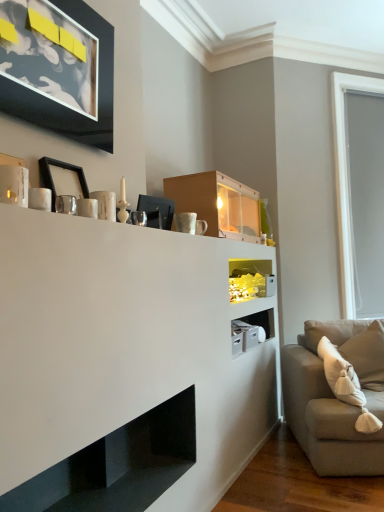
What do you see at coordinates (218, 204) in the screenshot? Image resolution: width=384 pixels, height=512 pixels. I see `matte wood cabinet at upper center` at bounding box center [218, 204].

This screenshot has height=512, width=384. Describe the element at coordinates (346, 177) in the screenshot. I see `gray matte window screen at right` at that location.

What is the approximate width of black glossy shelf at lower center, arranged as the second shelf when viewed from the back?

black glossy shelf at lower center, arranged as the second shelf when viewed from the back, is 16.80 inches in width.

Identify the location of black matte picture frame at upper left, the second picture frame from the bottom. This screenshot has height=512, width=384. (58, 68).

Describe the element at coordinates (52, 179) in the screenshot. I see `black matte picture frame at upper left, the second picture frame positioned from the top` at that location.

Locate an element on the screen. The height and width of the screenshot is (512, 384). light gray fabric couch at right is located at coordinates (337, 396).

Find the location of a particular element. matte wood cabinet at upper center is located at coordinates (218, 204).

Can you tell me how much beige soft cushion at right and matte wood cabinet at upper center differ in facing direction?

66.6 degrees.

Which object is positioned more to the left, beige soft cushion at right or matte wood cabinet at upper center?

From the viewer's perspective, matte wood cabinet at upper center appears more on the left side.

From the picture: Does beige soft cushion at right have a greater height compared to matte wood cabinet at upper center?

Yes, beige soft cushion at right is taller than matte wood cabinet at upper center.

Is beige soft cushion at right wider than matte wood cabinet at upper center?

Incorrect, the width of beige soft cushion at right does not surpass that of matte wood cabinet at upper center.

What's the angular difference between beige soft cushion at right and light gray fabric couch at right's facing directions?

0.484 degrees separate the facing orientations of beige soft cushion at right and light gray fabric couch at right.

Is beige soft cushion at right positioned far away from light gray fabric couch at right?

That's not correct — beige soft cushion at right is a little close to light gray fabric couch at right.

Which object is positioned more to the right, beige soft cushion at right or light gray fabric couch at right?

From the viewer's perspective, beige soft cushion at right appears more on the right side.

From the image's perspective, would you say beige soft cushion at right is positioned over light gray fabric couch at right?

Indeed, from the image's perspective, beige soft cushion at right is shown above light gray fabric couch at right.

How different are the orientations of black matte picture frame at upper left, which is counted as the 1th picture frame, starting from the top, and light gray fabric couch at right in degrees?

There is a 66.9-degree angle between the facing directions of black matte picture frame at upper left, which is counted as the 1th picture frame, starting from the top, and light gray fabric couch at right.

Could you tell me if black matte picture frame at upper left, the second picture frame from the bottom, is turned towards light gray fabric couch at right?

No, black matte picture frame at upper left, the second picture frame from the bottom, is not facing towards light gray fabric couch at right.

Is black matte picture frame at upper left, the second picture frame from the bottom, with light gray fabric couch at right?

No, black matte picture frame at upper left, the second picture frame from the bottom, is not beside light gray fabric couch at right.

Considering the positions of objects beige soft cushion at right and black matte picture frame at upper left, the second picture frame from the bottom, in the image provided, who is more to the right, beige soft cushion at right or black matte picture frame at upper left, the second picture frame from the bottom,?

From the viewer's perspective, beige soft cushion at right appears more on the right side.

Are beige soft cushion at right and black matte picture frame at upper left, which is counted as the 1th picture frame, starting from the top, far apart?

Indeed, beige soft cushion at right is not near black matte picture frame at upper left, which is counted as the 1th picture frame, starting from the top.

From the picture: Is beige soft cushion at right inside the boundaries of black matte picture frame at upper left, the second picture frame from the bottom, or outside?

The correct answer is: outside.

From the image's perspective, who appears lower, beige soft cushion at right or black matte picture frame at upper left, the second picture frame from the bottom?

beige soft cushion at right.

Does point (167, 180) come in front of point (337, 445)?

No, (167, 180) is behind (337, 445).

In the scene shown: Relative to light gray fabric couch at right, is matte wood cabinet at upper center in front or behind?

Visually, matte wood cabinet at upper center is located behind light gray fabric couch at right.

From the image's perspective, does matte wood cabinet at upper center appear lower than light gray fabric couch at right?

Incorrect, from the image's perspective, matte wood cabinet at upper center is higher than light gray fabric couch at right.

Is beige soft cushion at right aimed at translucent glass shelf at center, marked as the 1th shelf in a right-to-left arrangement?

No, beige soft cushion at right is not aimed at translucent glass shelf at center, marked as the 1th shelf in a right-to-left arrangement.

Is beige soft cushion at right inside the boundaries of translucent glass shelf at center, acting as the 2th shelf starting from the bottom, or outside?

beige soft cushion at right cannot be found inside translucent glass shelf at center, acting as the 2th shelf starting from the bottom.

Considering their positions, is beige soft cushion at right located in front of or behind translucent glass shelf at center, acting as the 2th shelf starting from the bottom?

Visually, beige soft cushion at right is located in front of translucent glass shelf at center, acting as the 2th shelf starting from the bottom.

From the picture: From a real-world perspective, is black glossy shelf at lower center, the second shelf when ordered from right to left, on top of gray matte window screen at right?

Incorrect, from a real-world perspective, black glossy shelf at lower center, the second shelf when ordered from right to left, is lower than gray matte window screen at right.

Considering the relative positions of black glossy shelf at lower center, the first shelf from the front, and gray matte window screen at right in the image provided, is black glossy shelf at lower center, the first shelf from the front, to the left or to the right of gray matte window screen at right?

Clearly, black glossy shelf at lower center, the first shelf from the front, is on the left of gray matte window screen at right in the image.

Who is bigger, black glossy shelf at lower center, arranged as the second shelf when viewed from the back, or gray matte window screen at right?

Bigger between the two is gray matte window screen at right.

From the image's perspective, between black glossy shelf at lower center, arranged as the second shelf when viewed from the back, and gray matte window screen at right, who is located below?

From the image's view, black glossy shelf at lower center, arranged as the second shelf when viewed from the back, is below.

Where is `pillow below the matte wood cabinet at upper center (from the image's perspective)`? This screenshot has height=512, width=384. pillow below the matte wood cabinet at upper center (from the image's perspective) is located at coordinates (367, 355).

I want to click on studio couch located underneath the beige soft cushion at right (from a real-world perspective), so click(337, 396).

Estimate the real-world distances between objects in this image. Which object is closer to black matte picture frame at upper left, the 1th picture frame from the bottom, black glossy shelf at lower center, arranged as the second shelf when viewed from the back, or beige soft cushion at right?

Based on the image, black glossy shelf at lower center, arranged as the second shelf when viewed from the back, appears to be nearer to black matte picture frame at upper left, the 1th picture frame from the bottom.

Which object lies nearer to the anchor point light gray fabric couch at right, black matte picture frame at upper left, the 1th picture frame from the bottom, or beige soft cushion at right?

The object closer to light gray fabric couch at right is beige soft cushion at right.

Considering their positions, is black glossy shelf at lower center, the first shelf from the bottom, positioned further to beige soft cushion at right than light gray fabric couch at right?

black glossy shelf at lower center, the first shelf from the bottom, is further to beige soft cushion at right.

From the image, which object appears to be farther from gray matte window screen at right, translucent glass shelf at center, which is the 2th shelf from front to back, or matte wood cabinet at upper center?

The object further to gray matte window screen at right is matte wood cabinet at upper center.

Which object lies further to the anchor point black glossy shelf at lower center, the first shelf when ordered from left to right, matte wood cabinet at upper center or beige soft cushion at right?

Based on the image, beige soft cushion at right appears to be further to black glossy shelf at lower center, the first shelf when ordered from left to right.

Looking at the image, which one is located closer to black matte picture frame at upper left, the second picture frame positioned from the top, black matte picture frame at upper left, which is counted as the 1th picture frame, starting from the top, or light gray fabric couch at right?

black matte picture frame at upper left, which is counted as the 1th picture frame, starting from the top, is positioned closer to the anchor black matte picture frame at upper left, the second picture frame positioned from the top.

Considering their positions, is black glossy shelf at lower center, the first shelf from the front, positioned further to black matte picture frame at upper left, the second picture frame positioned from the top, than black matte picture frame at upper left, the second picture frame from the bottom?

black glossy shelf at lower center, the first shelf from the front, lies further to black matte picture frame at upper left, the second picture frame positioned from the top, than the other object.

In the scene shown: Based on their spatial positions, is translucent glass shelf at center, acting as the 2th shelf starting from the bottom, or black glossy shelf at lower center, which appears as the 2th shelf when viewed from the top, closer to light gray fabric couch at right?

translucent glass shelf at center, acting as the 2th shelf starting from the bottom, lies closer to light gray fabric couch at right than the other object.

You are a GUI agent. You are given a task and a screenshot of the screen. Output one action in this format:
    pyautogui.click(x=<x>, y=<y>)
    Task: Click on the studio couch situated between black glossy shelf at lower center, the first shelf from the bottom, and beige soft cushion at right from left to right
    This screenshot has height=512, width=384.
    Given the screenshot: What is the action you would take?
    pyautogui.click(x=337, y=396)

Locate an element on the screen. This screenshot has height=512, width=384. cabinet between black matte picture frame at upper left, the second picture frame positioned from the top, and light gray fabric couch at right from left to right is located at coordinates (218, 204).

The height and width of the screenshot is (512, 384). Identify the location of shelf between black matte picture frame at upper left, the 1th picture frame from the bottom, and gray matte window screen at right in the front-back direction. (250, 279).

Locate an element on the screen. The image size is (384, 512). cabinet positioned between black glossy shelf at lower center, the first shelf when ordered from left to right, and gray matte window screen at right from near to far is located at coordinates (218, 204).